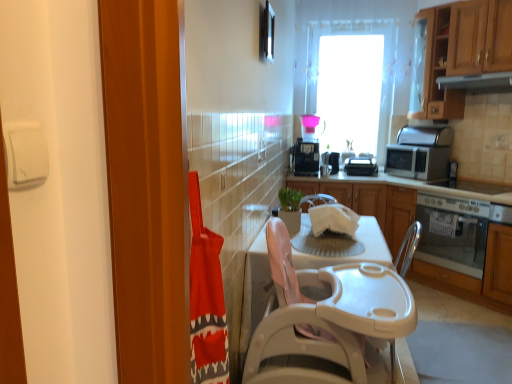
Question: In terms of height, does transparent glass window at upper center look taller or shorter compared to white plastic table at center, the 2th table viewed from the front?

Choices:
 (A) tall
 (B) short

Answer: (A)

Question: Considering the positions of transparent glass window at upper center and white plastic table at center, the 2th table viewed from the front, in the image, is transparent glass window at upper center bigger or smaller than white plastic table at center, the 2th table viewed from the front,?

Choices:
 (A) big
 (B) small

Answer: (B)

Question: Which object is the farthest from the wooden cabinet at right, arranged as the second cabinetry when viewed from the top?

Choices:
 (A) silver metallic microwave at right, which is the first appliance in right-to-left order
 (B) white plastic table at center, positioned as the first table in back-to-front order
 (C) satin silver oven at lower right
 (D) black plastic toaster at center, positioned as the second appliance in left-to-right order
 (E) transparent glass window at upper center

Answer: (B)

Question: Which object is positioned closest to the black plastic toaster at center, which is the 3th appliance from right to left?

Choices:
 (A) silver metallic microwave at right, which is the first appliance in right-to-left order
 (B) satin silver oven at lower right
 (C) wooden cabinet at right, arranged as the 1th cabinetry when ordered from the bottom
 (D) black plastic toaster at upper center, which is counted as the 1th appliance, starting from the left
 (E) satin silver exhaust hood at upper right

Answer: (D)